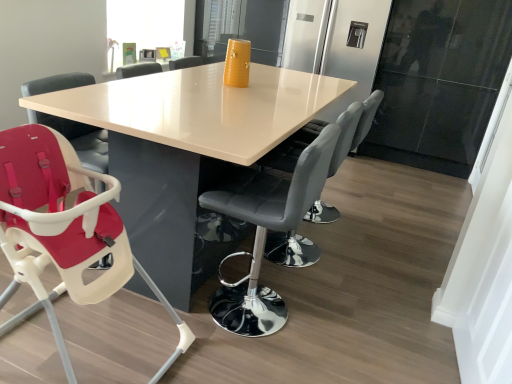
Locate an element on the screen. free area below matte white highchair at lower left, positioned as the 1th chair in left-to-right order (from a real-world perspective) is located at coordinates (93, 344).